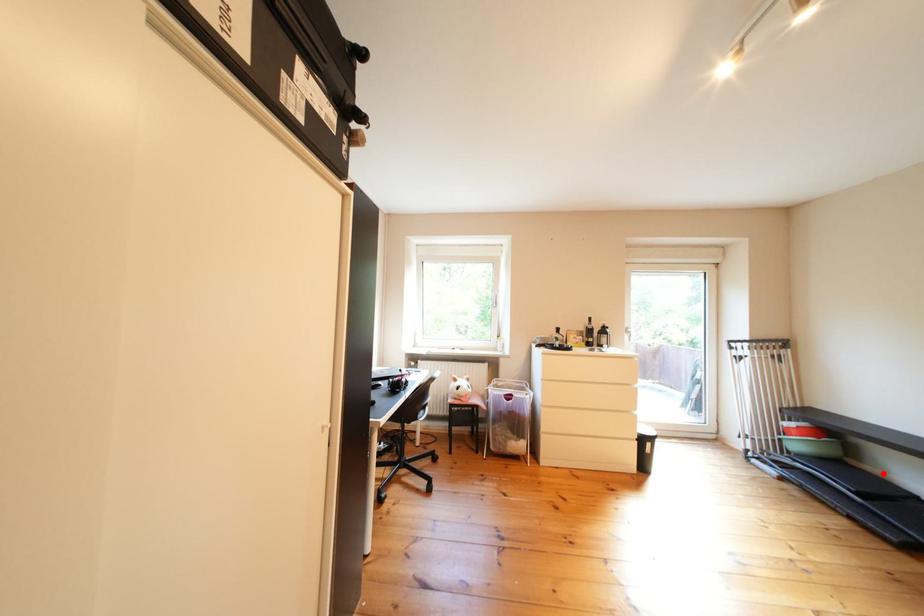
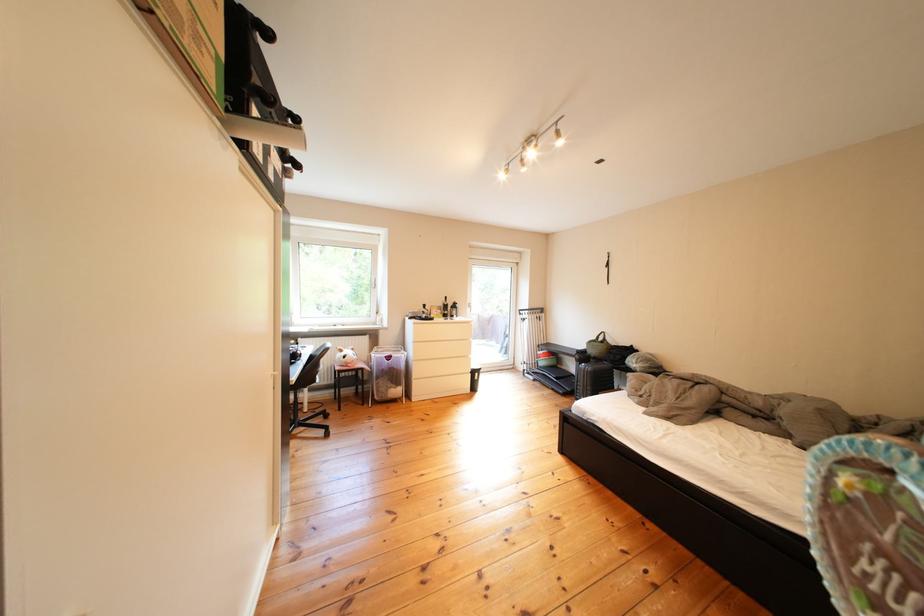
Question: I am providing you with two images of the same scene from different viewpoints. A red point is shown in image1. For the corresponding object point in image2, is it positioned nearer or farther from the camera?

Choices:
 (A) Nearer
 (B) Farther

Answer: (B)